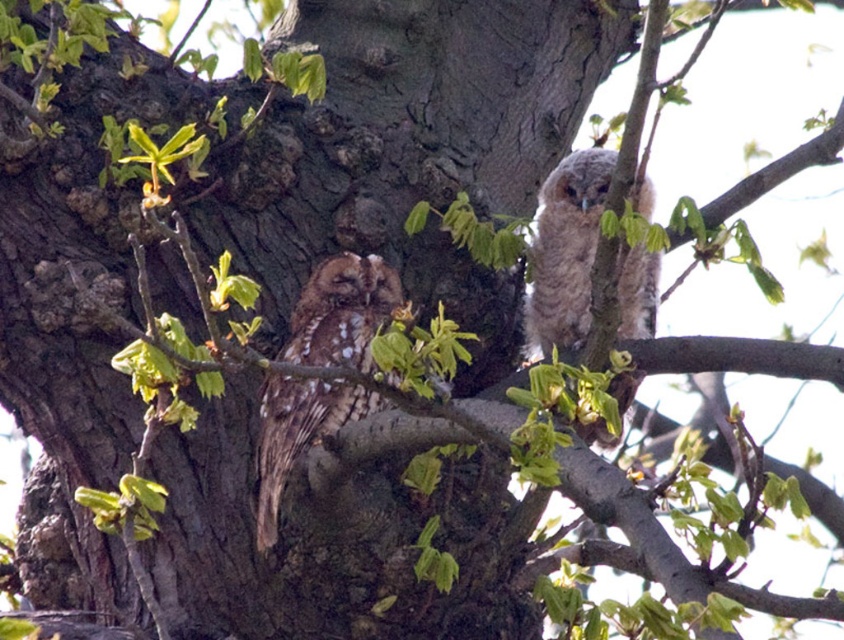
Question: Does brown speckled owl at left appear under speckled brown owl at upper right?

Choices:
 (A) yes
 (B) no

Answer: (A)

Question: Does brown speckled owl at left appear on the left side of speckled brown owl at upper right?

Choices:
 (A) no
 (B) yes

Answer: (B)

Question: Does brown speckled owl at left have a greater width compared to speckled brown owl at upper right?

Choices:
 (A) yes
 (B) no

Answer: (A)

Question: Which point is farther to the camera?

Choices:
 (A) (318, 380)
 (B) (572, 154)

Answer: (B)

Question: Which object appears closest to the camera in this image?

Choices:
 (A) brown speckled owl at left
 (B) speckled brown owl at upper right

Answer: (B)

Question: Which point is farther to the camera?

Choices:
 (A) brown speckled owl at left
 (B) speckled brown owl at upper right

Answer: (A)